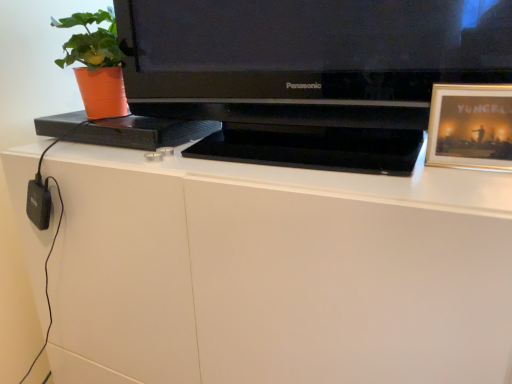
Question: From the image's perspective, does gold-framed picture at upper right appear lower than orange plastic pot at left?

Choices:
 (A) yes
 (B) no

Answer: (A)

Question: Could you tell me if gold-framed picture at upper right is facing orange plastic pot at left?

Choices:
 (A) no
 (B) yes

Answer: (A)

Question: Considering the relative sizes of gold-framed picture at upper right and orange plastic pot at left in the image provided, is gold-framed picture at upper right smaller than orange plastic pot at left?

Choices:
 (A) no
 (B) yes

Answer: (B)

Question: Does gold-framed picture at upper right have a greater height compared to orange plastic pot at left?

Choices:
 (A) yes
 (B) no

Answer: (B)

Question: Considering the relative sizes of gold-framed picture at upper right and orange plastic pot at left in the image provided, is gold-framed picture at upper right thinner than orange plastic pot at left?

Choices:
 (A) yes
 (B) no

Answer: (A)

Question: Considering the relative positions of gold-framed picture at upper right and orange plastic pot at left in the image provided, is gold-framed picture at upper right to the left or to the right of orange plastic pot at left?

Choices:
 (A) left
 (B) right

Answer: (B)

Question: From a real-world perspective, is gold-framed picture at upper right physically located above or below orange plastic pot at left?

Choices:
 (A) above
 (B) below

Answer: (B)

Question: Looking at their shapes, would you say gold-framed picture at upper right is wider or thinner than orange plastic pot at left?

Choices:
 (A) thin
 (B) wide

Answer: (A)

Question: In terms of size, does gold-framed picture at upper right appear bigger or smaller than orange plastic pot at left?

Choices:
 (A) small
 (B) big

Answer: (A)

Question: From the image's perspective, relative to white matte desk at center, is gold-framed picture at upper right above or below?

Choices:
 (A) below
 (B) above

Answer: (B)

Question: Is point (478, 86) positioned closer to the camera than point (270, 304)?

Choices:
 (A) farther
 (B) closer

Answer: (B)

Question: From a real-world perspective, is gold-framed picture at upper right positioned above or below white matte desk at center?

Choices:
 (A) below
 (B) above

Answer: (B)

Question: Relative to white matte desk at center, is gold-framed picture at upper right in front or behind?

Choices:
 (A) front
 (B) behind

Answer: (B)

Question: Considering their positions, is black glossy television at center located in front of or behind white matte desk at center?

Choices:
 (A) front
 (B) behind

Answer: (B)

Question: From a real-world perspective, is black glossy television at center above or below white matte desk at center?

Choices:
 (A) above
 (B) below

Answer: (A)